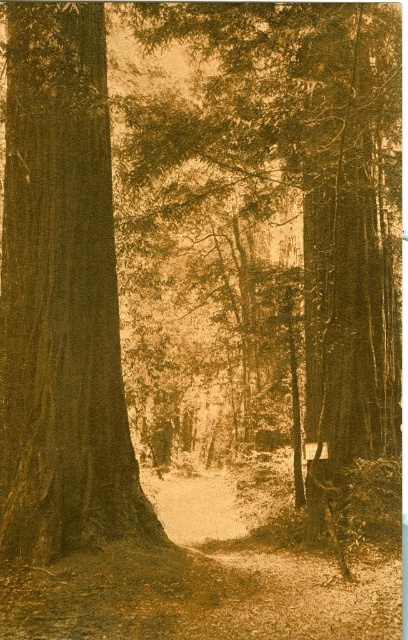
Question: Among these objects, which one is nearest to the camera?

Choices:
 (A) smooth brown tree trunk at left
 (B) smooth brown tree trunk at center

Answer: (A)

Question: Does smooth brown tree trunk at center appear on the left side of smooth brown tree trunk at left?

Choices:
 (A) yes
 (B) no

Answer: (B)

Question: Can you confirm if smooth brown tree trunk at center is positioned below smooth brown tree trunk at left?

Choices:
 (A) yes
 (B) no

Answer: (B)

Question: Is smooth brown tree trunk at center closer to camera compared to smooth brown tree trunk at left?

Choices:
 (A) no
 (B) yes

Answer: (A)